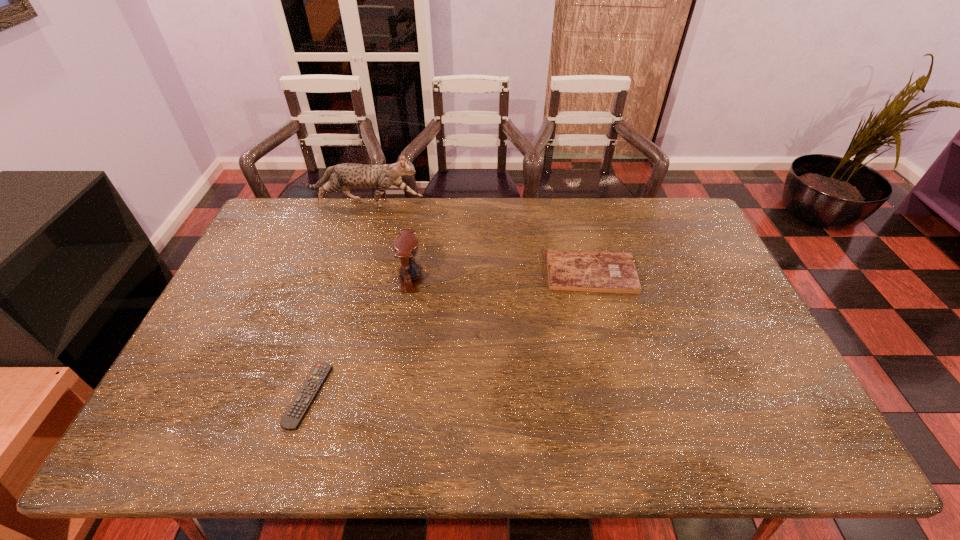
Where is `cat`? The height and width of the screenshot is (540, 960). cat is located at coordinates (347, 175).

At what (x,y) coordinates should I click in order to perform the action: click on the tallest object. Please return your answer as a coordinate pair (x, y). This screenshot has height=540, width=960. Looking at the image, I should click on (347, 175).

I want to click on hourglass, so click(x=405, y=246).

This screenshot has width=960, height=540. Identify the location of the second shortest object. (568, 270).

Image resolution: width=960 pixels, height=540 pixels. Find the location of `the rightmost object`. the rightmost object is located at coordinates (568, 270).

What are the coordinates of `the nearest object` in the screenshot? It's located at (293, 417).

The width and height of the screenshot is (960, 540). I want to click on the shortest object, so click(293, 417).

Image resolution: width=960 pixels, height=540 pixels. Identify the location of free location located 0.270m on the face of the cat. point(494,204).

You are a GUI agent. You are given a task and a screenshot of the screen. Output one action in this format:
    pyautogui.click(x=<x>, y=<y>)
    Task: Click on the vacant space located 0.370m on the left of the hourglass
    Image resolution: width=960 pixels, height=540 pixels.
    Given the screenshot: What is the action you would take?
    pyautogui.click(x=281, y=279)

Find the location of `free region located on the front of the Bible`. free region located on the front of the Bible is located at coordinates (612, 361).